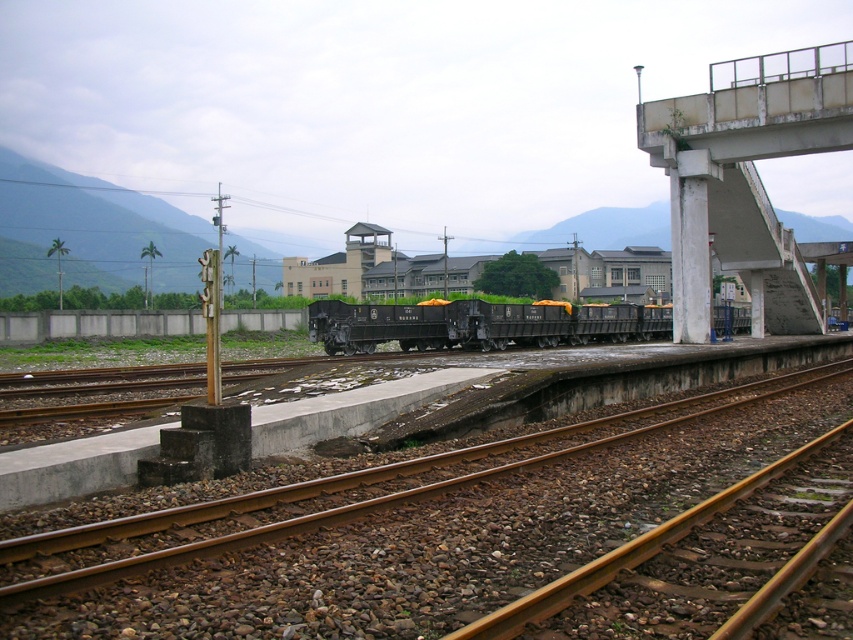
You are a train engineer operating a freight train that is 25 meters long. You need to pass under the concrete bridge at right. Can your train fit under the bridge based on the distance provided?

The distance between the concrete bridge at right and the camera is 26.11 meters. Since your train is 25 meters long, it can fit under the concrete bridge at right as the length of the bridge is sufficient to accommodate the train.

You are a train engineer trying to navigate your locomotive through this area. You notice the brown gravel track at center and the concrete bridge at right. Which path should you choose if you need to take the wider route?

The concrete bridge at right is wider than the brown gravel track at center, so you should choose the concrete bridge at right for the wider route.